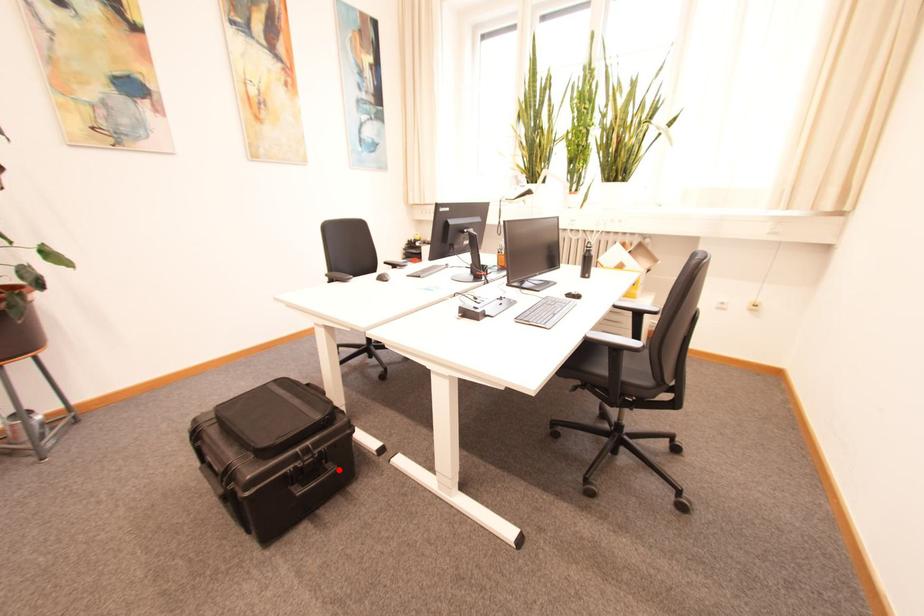
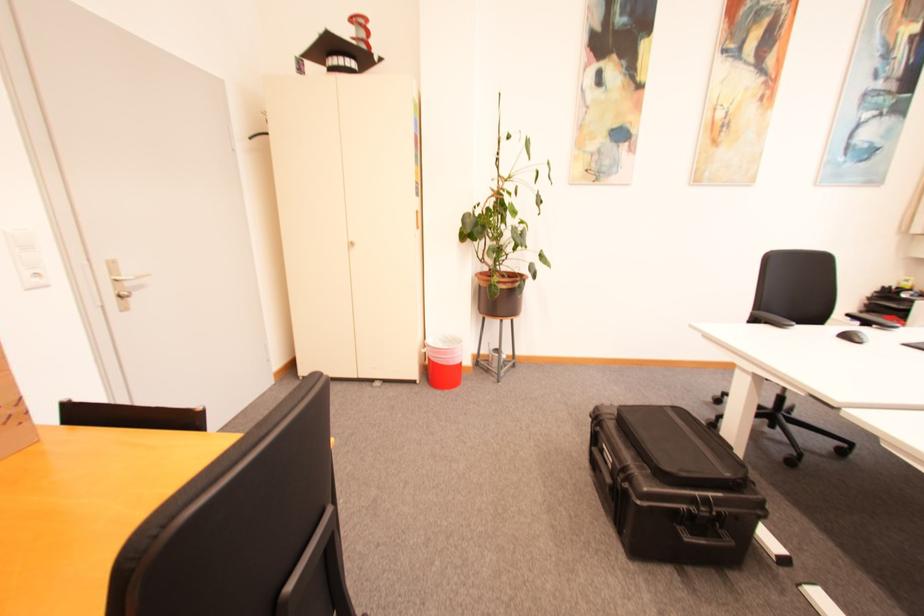
Question: I am providing you with two images of the same scene from different viewpoints. A red point is marked on the first image. Can you still see the location of the red point in image 2?

Choices:
 (A) Yes
 (B) No

Answer: (A)